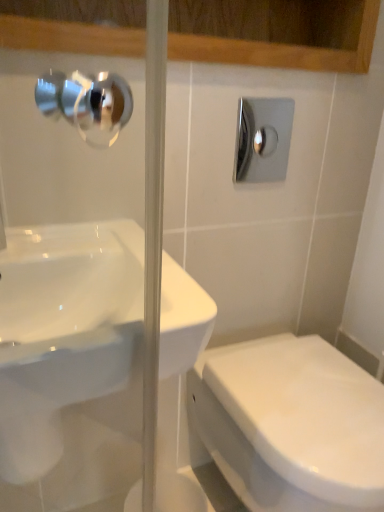
Where is `white glossy toilet at lower right`? white glossy toilet at lower right is located at coordinates (291, 424).

From the image's perspective, is white glossy toilet at lower right positioned above or below polished chrome shower at upper right?

Clearly, from the image's perspective, white glossy toilet at lower right is below polished chrome shower at upper right.

Is white glossy toilet at lower right bigger than polished chrome shower at upper right?

Indeed, white glossy toilet at lower right has a larger size compared to polished chrome shower at upper right.

Is white glossy toilet at lower right directly adjacent to polished chrome shower at upper right?

No.

Is point (205, 364) positioned behind point (275, 100)?

That is True.

Which is closer, [50,362] or [337,399]?

Point [50,362] is positioned closer to the camera compared to point [337,399].

Measure the distance from white glossy sink at center to white glossy toilet at lower right.

white glossy sink at center and white glossy toilet at lower right are 16.88 inches apart.

Looking at this image, what's the angular difference between white glossy sink at center and white glossy toilet at lower right's facing directions?

There is a 0.628-degree angle between the facing directions of white glossy sink at center and white glossy toilet at lower right.

From the image's perspective, is white glossy sink at center positioned above or below white glossy toilet at lower right?

white glossy sink at center is above white glossy toilet at lower right.

Is white glossy sink at center oriented away from polished chrome shower at upper right?

white glossy sink at center does not have its back to polished chrome shower at upper right.

Which object is wider, white glossy sink at center or polished chrome shower at upper right?

white glossy sink at center is wider.

Based on the photo, can you tell me how much white glossy sink at center and polished chrome shower at upper right differ in facing direction?

white glossy sink at center and polished chrome shower at upper right are facing 0.136 degrees away from each other.

Considering the relative sizes of white glossy sink at center and polished chrome shower at upper right in the image provided, is white glossy sink at center shorter than polished chrome shower at upper right?

Yes, white glossy sink at center is shorter than polished chrome shower at upper right.

Is white glossy toilet at lower right oriented towards white glossy sink at center?

No, white glossy toilet at lower right does not turn towards white glossy sink at center.

Is white glossy toilet at lower right outside of white glossy sink at center?

white glossy toilet at lower right is positioned outside white glossy sink at center.

Is white glossy toilet at lower right not close to white glossy sink at center?

white glossy toilet at lower right is actually quite close to white glossy sink at center.

Based on the photo, which of these two, polished chrome shower at upper right or white glossy toilet at lower right, is smaller?

With smaller size is polished chrome shower at upper right.

Does polished chrome shower at upper right touch white glossy toilet at lower right?

No.

Looking at this image, which of these two, polished chrome shower at upper right or white glossy toilet at lower right, is thinner?

With smaller width is polished chrome shower at upper right.

Is polished chrome shower at upper right next to white glossy sink at center?

No, polished chrome shower at upper right is not in contact with white glossy sink at center.

Is the position of polished chrome shower at upper right more distant than that of white glossy sink at center?

Yes, polished chrome shower at upper right is behind white glossy sink at center.

Can you confirm if polished chrome shower at upper right is positioned to the left of white glossy sink at center?

In fact, polished chrome shower at upper right is to the right of white glossy sink at center.

Is polished chrome shower at upper right facing away from white glossy sink at center?

No, polished chrome shower at upper right is not facing the opposite direction of white glossy sink at center.

You are a GUI agent. You are given a task and a screenshot of the screen. Output one action in this format:
    pyautogui.click(x=<x>, y=<y>)
    Task: Click on the shower located on the left of white glossy toilet at lower right
    This screenshot has height=512, width=384.
    Given the screenshot: What is the action you would take?
    pyautogui.click(x=263, y=139)

This screenshot has height=512, width=384. I want to click on sink that is above the white glossy toilet at lower right (from the image's perspective), so click(63, 331).

Based on their spatial positions, is white glossy toilet at lower right or polished chrome shower at upper right closer to white glossy sink at center?

white glossy toilet at lower right lies closer to white glossy sink at center than the other object.

Considering their positions, is white glossy sink at center positioned closer to polished chrome shower at upper right than white glossy toilet at lower right?

white glossy sink at center is positioned closer to the anchor polished chrome shower at upper right.

From the image, which object appears to be farther from white glossy sink at center, polished chrome shower at upper right or white glossy toilet at lower right?

polished chrome shower at upper right lies further to white glossy sink at center than the other object.

Which object lies further to the anchor point white glossy toilet at lower right, polished chrome shower at upper right or white glossy sink at center?

polished chrome shower at upper right.

In the scene shown: Estimate the real-world distances between objects in this image. Which object is further from white glossy toilet at lower right, white glossy sink at center or polished chrome shower at upper right?

polished chrome shower at upper right.

From the image, which object appears to be nearer to polished chrome shower at upper right, white glossy toilet at lower right or white glossy sink at center?

white glossy sink at center lies closer to polished chrome shower at upper right than the other object.

This screenshot has height=512, width=384. Find the location of `sink that lies between polished chrome shower at upper right and white glossy toilet at lower right from top to bottom`. sink that lies between polished chrome shower at upper right and white glossy toilet at lower right from top to bottom is located at coordinates (63, 331).